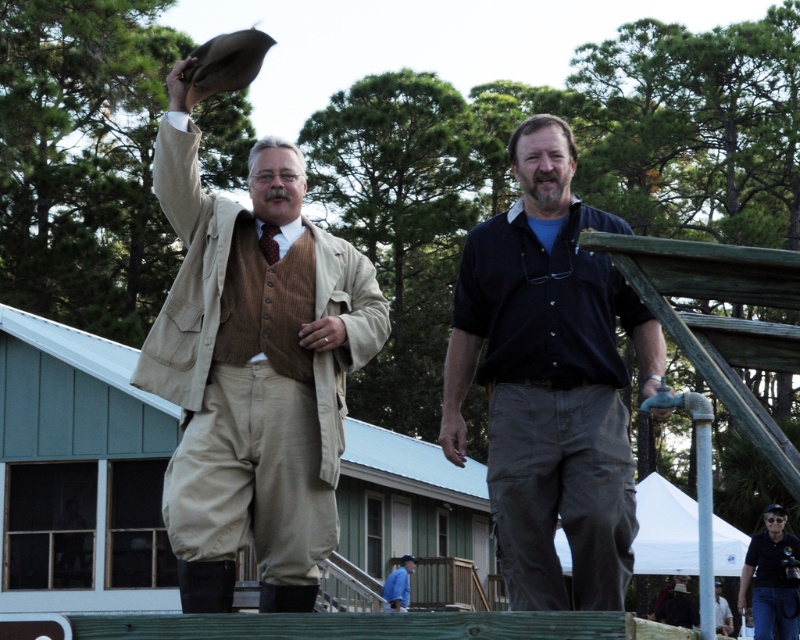
Question: Observing the image, what is the correct spatial positioning of dark blue polo shirt at lower right in reference to light blue shirt at center?

Choices:
 (A) below
 (B) above

Answer: (B)

Question: Can you confirm if beige wool suit at center is positioned to the left of dark brown leather jacket at center?

Choices:
 (A) yes
 (B) no

Answer: (A)

Question: Is dark blue shirt at center above dark blue polo shirt at lower right?

Choices:
 (A) no
 (B) yes

Answer: (B)

Question: Among these objects, which one is nearest to the camera?

Choices:
 (A) light blue shirt at center
 (B) blue denim shirt at lower center
 (C) dark brown leather jacket at center

Answer: (A)

Question: Estimate the real-world distances between objects in this image. Which object is closer to the blue denim shirt at lower center?

Choices:
 (A) dark brown leather jacket at center
 (B) beige wool suit at center
 (C) dark blue polo shirt at lower right
 (D) dark blue shirt at center

Answer: (A)

Question: Which is farther from the blue denim shirt at lower center?

Choices:
 (A) dark brown leather jacket at center
 (B) beige wool suit at center
 (C) dark blue polo shirt at lower right
 (D) light blue shirt at center

Answer: (B)